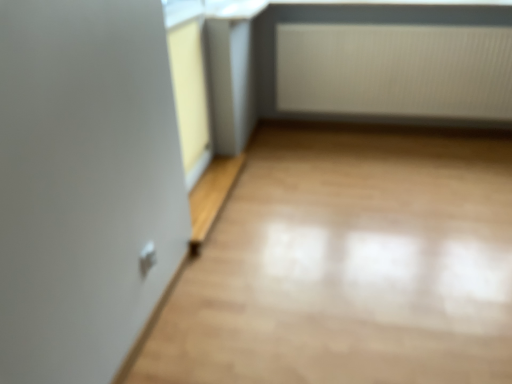
Question: In terms of width, does white textured radiator at upper right look wider or thinner when compared to yellow matte window frame at upper left?

Choices:
 (A) thin
 (B) wide

Answer: (B)

Question: Is white textured radiator at upper right in front of or behind yellow matte window frame at upper left in the image?

Choices:
 (A) front
 (B) behind

Answer: (B)

Question: Considering the positions of white textured radiator at upper right and yellow matte window frame at upper left in the image, is white textured radiator at upper right taller or shorter than yellow matte window frame at upper left?

Choices:
 (A) short
 (B) tall

Answer: (A)

Question: In terms of height, does yellow matte window frame at upper left look taller or shorter compared to white textured radiator at upper right?

Choices:
 (A) tall
 (B) short

Answer: (A)

Question: Is yellow matte window frame at upper left bigger or smaller than white textured radiator at upper right?

Choices:
 (A) small
 (B) big

Answer: (A)

Question: From the image's perspective, is yellow matte window frame at upper left positioned above or below white textured radiator at upper right?

Choices:
 (A) above
 (B) below

Answer: (B)

Question: Is point (201, 67) closer or farther from the camera than point (411, 84)?

Choices:
 (A) closer
 (B) farther

Answer: (A)